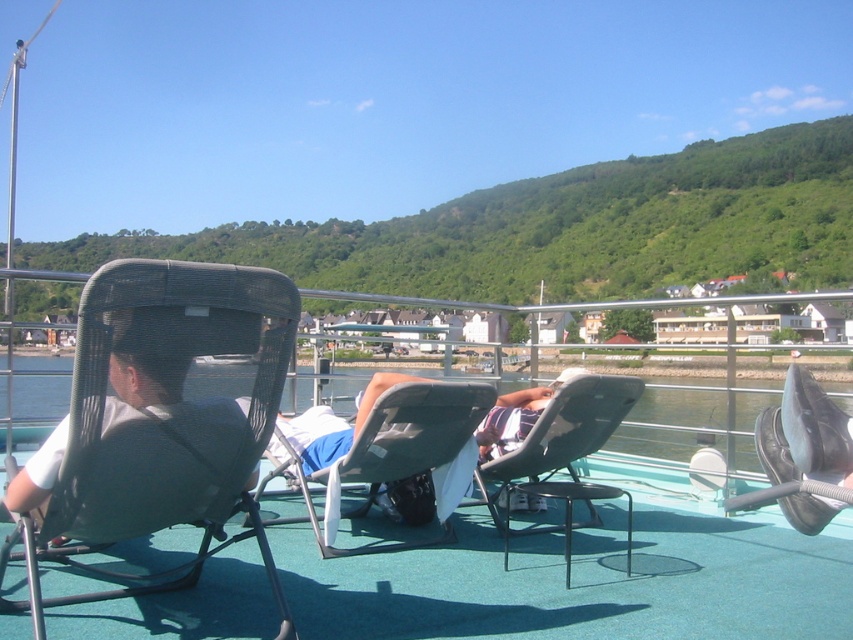
Question: Is blue fabric shorts at center thinner than striped fabric towel at center?

Choices:
 (A) no
 (B) yes

Answer: (B)

Question: Can you confirm if gray mesh chair at center is smaller than striped fabric towel at center?

Choices:
 (A) yes
 (B) no

Answer: (A)

Question: Is matte black chair at left below gray mesh chair at center?

Choices:
 (A) no
 (B) yes

Answer: (A)

Question: Among these objects, which one is farthest from the camera?

Choices:
 (A) matte black chair at center
 (B) matte black chair at left

Answer: (A)

Question: Which object is closer to the camera taking this photo?

Choices:
 (A) matte black chair at left
 (B) green fabric boat deck at center
 (C) matte black chair at center

Answer: (A)

Question: Which point is farther to the camera?

Choices:
 (A) blue fabric shorts at center
 (B) gray mesh chair at center
 (C) green fabric boat deck at center
 (D) striped fabric towel at center

Answer: (D)